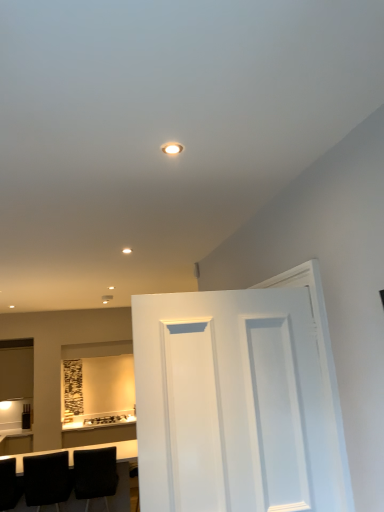
This screenshot has width=384, height=512. What do you see at coordinates (83, 448) in the screenshot?
I see `black leather table at lower left` at bounding box center [83, 448].

The width and height of the screenshot is (384, 512). I want to click on matte black toaster at lower center, so click(x=109, y=419).

Is matte black toaster at lower center oriented away from black leather chair at lower left, positioned as the second chair in right-to-left order?

No, matte black toaster at lower center's orientation is not away from black leather chair at lower left, positioned as the second chair in right-to-left order.

Is matte black toaster at lower center taller or shorter than black leather chair at lower left, positioned as the second chair in right-to-left order?

In the image, matte black toaster at lower center appears to be shorter than black leather chair at lower left, positioned as the second chair in right-to-left order.

You are a GUI agent. You are given a task and a screenshot of the screen. Output one action in this format:
    pyautogui.click(x=<x>, y=<y>)
    Task: Click on the appliance above the black leather chair at lower left, positioned as the second chair in right-to-left order (from a real-world perspective)
    
    Given the screenshot: What is the action you would take?
    click(x=109, y=419)

Identify the location of chair behind the black leather chair at lower left, positioned as the second chair in right-to-left order. (95, 474).

Is there a large distance between black matte chair at lower left, the 3th chair viewed from the left, and black leather chair at lower left, positioned as the second chair in right-to-left order?

No.

Does black matte chair at lower left, the 3th chair viewed from the left, appear on the right side of black leather chair at lower left, positioned as the second chair in right-to-left order?

Yes, black matte chair at lower left, the 3th chair viewed from the left, is to the right of black leather chair at lower left, positioned as the second chair in right-to-left order.

Is white painted wood door at center shorter than black matte chair at lower left, the 3th chair viewed from the left?

In fact, white painted wood door at center may be taller than black matte chair at lower left, the 3th chair viewed from the left.

Do you think white painted wood door at center is within black matte chair at lower left, the 3th chair viewed from the left, or outside of it?

white painted wood door at center cannot be found inside black matte chair at lower left, the 3th chair viewed from the left.

From a real-world perspective, which is physically above, white painted wood door at center or black matte chair at lower left, the first chair when ordered from right to left?

white painted wood door at center, from a real-world perspective.

Is there a large distance between white painted wood door at center and black matte chair at lower left, the 3th chair viewed from the left?

Indeed, white painted wood door at center is not near black matte chair at lower left, the 3th chair viewed from the left.

In the image, is black leather chair at lower left, positioned as the second chair in right-to-left order, on the left side or the right side of black leather table at lower left?

black leather chair at lower left, positioned as the second chair in right-to-left order, is positioned on black leather table at lower left's right side.

From the picture: From the image's perspective, is black leather chair at lower left, the 2th chair positioned from the left, above or below black leather table at lower left?

Based on their image positions, black leather chair at lower left, the 2th chair positioned from the left, is located above black leather table at lower left.

Does black leather chair at lower left, positioned as the second chair in right-to-left order, have a greater height compared to black leather table at lower left?

Incorrect, the height of black leather chair at lower left, positioned as the second chair in right-to-left order, is not larger of that of black leather table at lower left.

Between black leather chair at lower left, positioned as the second chair in right-to-left order, and black leather table at lower left, which one has smaller size?

With smaller size is black leather chair at lower left, positioned as the second chair in right-to-left order.

From a real-world perspective, is white painted wood door at center located higher than black leather chair at lower left, positioned as the second chair in right-to-left order?

Yes.

Is white painted wood door at center touching black leather chair at lower left, the 2th chair positioned from the left?

white painted wood door at center and black leather chair at lower left, the 2th chair positioned from the left, are not in contact.

Considering the positions of points (296, 336) and (67, 470), is point (296, 336) closer to camera compared to point (67, 470)?

Yes, it is in front of point (67, 470).

Identify the location of door in front of the black leather chair at lower left, the 2th chair positioned from the left. The width and height of the screenshot is (384, 512). (230, 402).

What are the coordinates of `the 3rd chair positioned below the white painted wood door at center (from the image's perspective)` in the screenshot? It's located at (95, 474).

Based on the photo, is black matte chair at lower left, the first chair when ordered from right to left, positioned far away from white painted wood door at center?

Absolutely, black matte chair at lower left, the first chair when ordered from right to left, is distant from white painted wood door at center.

Which of these two, black matte chair at lower left, the 3th chair viewed from the left, or white painted wood door at center, stands taller?

With more height is white painted wood door at center.

Considering the positions of point (43, 494) and point (110, 417), is point (43, 494) closer or farther from the camera than point (110, 417)?

Point (43, 494).

Which object is further away from the camera taking this photo, black leather chair at lower left, the 2th chair positioned from the left, or matte black toaster at lower center?

matte black toaster at lower center.

Can you tell me how much black leather chair at lower left, the 2th chair positioned from the left, and matte black toaster at lower center differ in facing direction?

black leather chair at lower left, the 2th chair positioned from the left, and matte black toaster at lower center are facing 178 degrees away from each other.

Are black leather chair at lower left, the 2th chair positioned from the left, and matte black toaster at lower center far apart?

black leather chair at lower left, the 2th chair positioned from the left, is positioned a significant distance from matte black toaster at lower center.

The width and height of the screenshot is (384, 512). There is a black leather chair at lower left, the 2th chair positioned from the left. Identify the location of appliance above it (from a real-world perspective). (109, 419).

The width and height of the screenshot is (384, 512). Identify the location of chair below the black leather chair at lower left, positioned as the second chair in right-to-left order (from the image's perspective). (95, 474).

Looking at the image, which one is located closer to black leather chair at lower left, marked as the third chair in a right-to-left arrangement, matte black toaster at lower center or black leather table at lower left?

black leather table at lower left lies closer to black leather chair at lower left, marked as the third chair in a right-to-left arrangement, than the other object.

Considering their positions, is black leather chair at lower left, positioned as the second chair in right-to-left order, positioned further to black leather table at lower left than black leather chair at lower left, the first chair in the left-to-right sequence?

black leather chair at lower left, the first chair in the left-to-right sequence.

From the picture: Estimate the real-world distances between objects in this image. Which object is closer to white painted wood door at center, matte black toaster at lower center or black leather chair at lower left, marked as the third chair in a right-to-left arrangement?

black leather chair at lower left, marked as the third chair in a right-to-left arrangement, is closer to white painted wood door at center.

Considering their positions, is white painted wood door at center positioned closer to black matte chair at lower left, the first chair when ordered from right to left, than black leather chair at lower left, marked as the third chair in a right-to-left arrangement?

Among the two, black leather chair at lower left, marked as the third chair in a right-to-left arrangement, is located nearer to black matte chair at lower left, the first chair when ordered from right to left.

Based on their spatial positions, is matte black toaster at lower center or black leather table at lower left closer to white painted wood door at center?

Based on the image, black leather table at lower left appears to be nearer to white painted wood door at center.

Estimate the real-world distances between objects in this image. Which object is closer to black matte chair at lower left, the first chair when ordered from right to left, black leather chair at lower left, the 2th chair positioned from the left, or white painted wood door at center?

Among the two, black leather chair at lower left, the 2th chair positioned from the left, is located nearer to black matte chair at lower left, the first chair when ordered from right to left.

When comparing their distances from black matte chair at lower left, the 3th chair viewed from the left, does white painted wood door at center or matte black toaster at lower center seem further?

matte black toaster at lower center.

Looking at the image, which one is located further to matte black toaster at lower center, white painted wood door at center or black leather chair at lower left, positioned as the second chair in right-to-left order?

The object further to matte black toaster at lower center is white painted wood door at center.

Locate an element on the screen. chair positioned between black leather chair at lower left, positioned as the second chair in right-to-left order, and matte black toaster at lower center from near to far is located at coordinates (95, 474).

This screenshot has height=512, width=384. I want to click on chair between black leather chair at lower left, the first chair in the left-to-right sequence, and black matte chair at lower left, the first chair when ordered from right to left, in the horizontal direction, so click(47, 479).

Identify the location of table located between white painted wood door at center and matte black toaster at lower center in the depth direction. Image resolution: width=384 pixels, height=512 pixels. (83, 448).

In order to click on chair between white painted wood door at center and black leather chair at lower left, positioned as the second chair in right-to-left order, along the z-axis in this screenshot , I will do `click(9, 485)`.